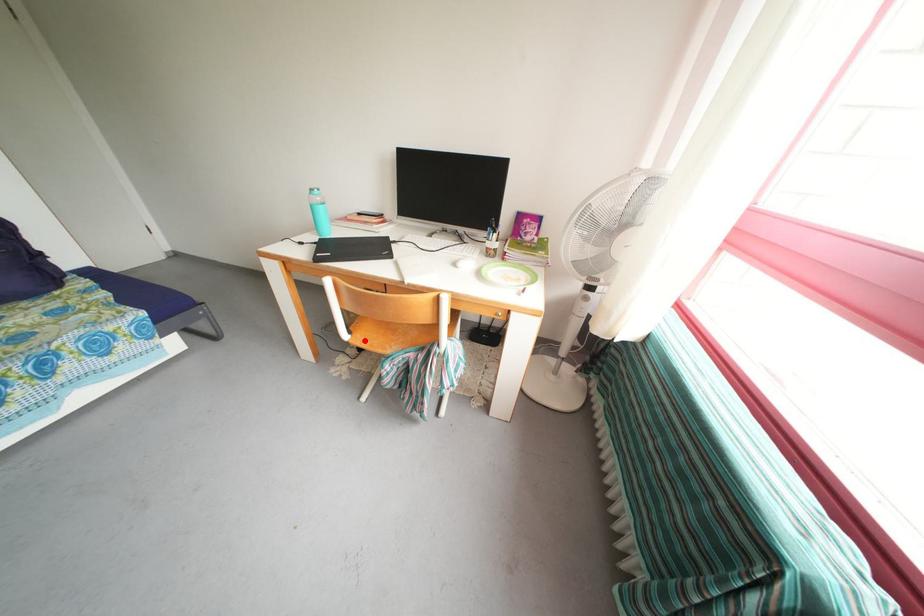
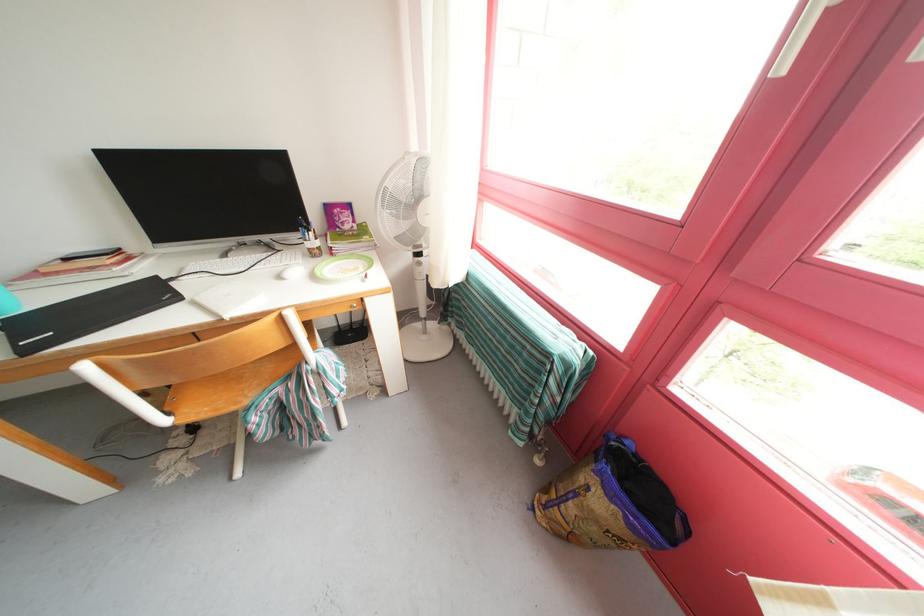
Question: I am providing you with two images of the same scene from different viewpoints. Given a red point in image1, look at the same physical point in image2. Is it:

Choices:
 (A) Closer to the viewpoint
 (B) Farther from the viewpoint

Answer: (A)